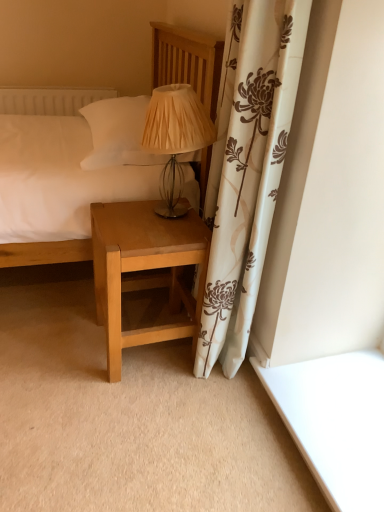
Measure the distance between point (179, 335) and camera.

The depth of point (179, 335) is 4.81 feet.

Describe the element at coordinates (187, 60) in the screenshot. I see `matte wood bed at center` at that location.

This screenshot has width=384, height=512. Identify the location of matte wood bed at center. (187, 60).

In order to face matte beige fabric lampshade at center, should I rotate leftwards or rightwards?

Rotate your view left by about 3.255°.

Image resolution: width=384 pixels, height=512 pixels. In order to click on light brown wood nightstand at lower center in this screenshot , I will do `click(145, 270)`.

You are a GUI agent. You are given a task and a screenshot of the screen. Output one action in this format:
    pyautogui.click(x=<x>, y=<y>)
    Task: Click on the bed on the left of light brown wood nightstand at lower center
    Image resolution: width=384 pixels, height=512 pixels.
    Given the screenshot: What is the action you would take?
    pyautogui.click(x=187, y=60)

Considering the relative sizes of light brown wood nightstand at lower center and matte wood bed at center in the image provided, is light brown wood nightstand at lower center bigger than matte wood bed at center?

No, light brown wood nightstand at lower center is not bigger than matte wood bed at center.

Considering the sizes of objects light brown wood nightstand at lower center and matte wood bed at center in the image provided, who is wider, light brown wood nightstand at lower center or matte wood bed at center?

With larger width is matte wood bed at center.

Are light brown wood nightstand at lower center and matte wood bed at center making contact?

No, light brown wood nightstand at lower center is not beside matte wood bed at center.

Is matte beige fabric lampshade at center turned away from matte wood bed at center?

No.

What's the angular difference between matte beige fabric lampshade at center and matte wood bed at center's facing directions?

matte beige fabric lampshade at center and matte wood bed at center are facing 91.8 degrees away from each other.

From the image's perspective, would you say matte beige fabric lampshade at center is shown under matte wood bed at center?

Indeed, from the image's perspective, matte beige fabric lampshade at center is shown beneath matte wood bed at center.

Is light brown wood nightstand at lower center placed right next to matte beige fabric lampshade at center?

No.

Who is shorter, light brown wood nightstand at lower center or matte beige fabric lampshade at center?

matte beige fabric lampshade at center is shorter.

Which object is further away from the camera, light brown wood nightstand at lower center or matte beige fabric lampshade at center?

light brown wood nightstand at lower center.

Is matte wood bed at center aimed at matte beige fabric lampshade at center?

Yes.

Is the depth of matte wood bed at center less than that of matte beige fabric lampshade at center?

Yes, it is.

Is the surface of matte wood bed at center in direct contact with matte beige fabric lampshade at center?

matte wood bed at center and matte beige fabric lampshade at center are clearly separated.

From the picture: Based on their positions, is matte beige fabric lampshade at center located to the left or right of light brown wood nightstand at lower center?

In the image, matte beige fabric lampshade at center appears on the right side of light brown wood nightstand at lower center.

From the image's perspective, is matte beige fabric lampshade at center positioned above or below light brown wood nightstand at lower center?

matte beige fabric lampshade at center is situated higher than light brown wood nightstand at lower center in the image.

Identify the location of table lamp located on the right of light brown wood nightstand at lower center. The image size is (384, 512). (175, 136).

How distant is matte beige fabric lampshade at center from light brown wood nightstand at lower center?

matte beige fabric lampshade at center and light brown wood nightstand at lower center are 16.55 inches apart from each other.

Looking at this image, can you tell me how much matte wood bed at center and light brown wood nightstand at lower center differ in facing direction?

The angle between the facing direction of matte wood bed at center and the facing direction of light brown wood nightstand at lower center is 89.3 degrees.

Who is smaller, matte wood bed at center or light brown wood nightstand at lower center?

light brown wood nightstand at lower center is smaller.

Is matte wood bed at center turned away from light brown wood nightstand at lower center?

No.

Does matte wood bed at center appear on the right side of light brown wood nightstand at lower center?

Incorrect, matte wood bed at center is not on the right side of light brown wood nightstand at lower center.

I want to click on nightstand behind the matte wood bed at center, so click(x=145, y=270).

The height and width of the screenshot is (512, 384). What are the coordinates of `table lamp lying below the matte wood bed at center (from the image's perspective)` in the screenshot? It's located at point(175,136).

When comparing their distances from matte beige fabric lampshade at center, does matte wood bed at center or light brown wood nightstand at lower center seem closer?

matte wood bed at center is closer to matte beige fabric lampshade at center.

Which object lies nearer to the anchor point matte wood bed at center, matte beige fabric lampshade at center or light brown wood nightstand at lower center?

matte beige fabric lampshade at center.

Considering their positions, is light brown wood nightstand at lower center positioned further to matte wood bed at center than matte beige fabric lampshade at center?

The object further to matte wood bed at center is light brown wood nightstand at lower center.

When comparing their distances from light brown wood nightstand at lower center, does matte wood bed at center or matte beige fabric lampshade at center seem closer?

Based on the image, matte beige fabric lampshade at center appears to be nearer to light brown wood nightstand at lower center.

Estimate the real-world distances between objects in this image. Which object is closer to light brown wood nightstand at lower center, matte beige fabric lampshade at center or matte wood bed at center?

matte beige fabric lampshade at center is closer to light brown wood nightstand at lower center.

Estimate the real-world distances between objects in this image. Which object is further from matte beige fabric lampshade at center, light brown wood nightstand at lower center or matte wood bed at center?

light brown wood nightstand at lower center lies further to matte beige fabric lampshade at center than the other object.

What are the coordinates of `table lamp between matte wood bed at center and light brown wood nightstand at lower center from top to bottom` in the screenshot? It's located at (175, 136).